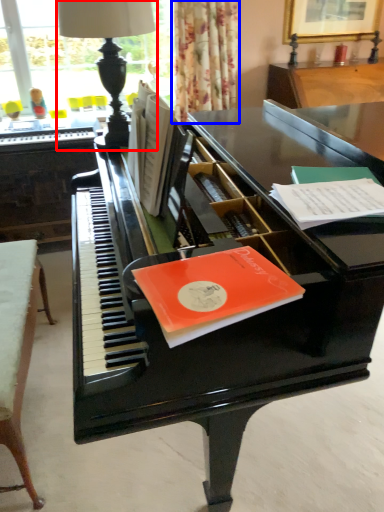
Question: Which object appears closest to the camera in this image, table lamp (highlighted by a red box) or curtain (highlighted by a blue box)?

Choices:
 (A) table lamp
 (B) curtain

Answer: (A)